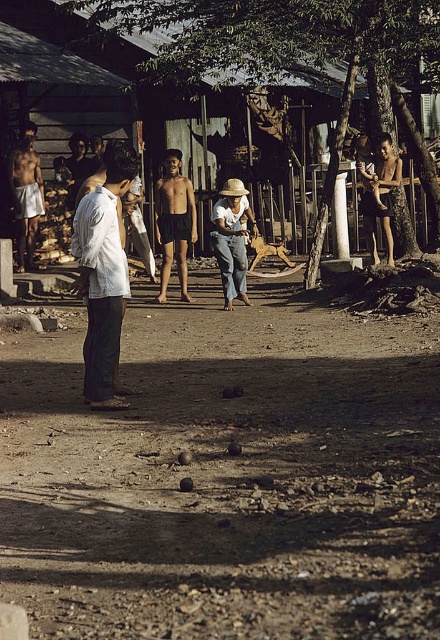
Question: Estimate the real-world distances between objects in this image. Which object is farther from the brown dirt field at center?

Choices:
 (A) light brown straw hat at center
 (B) dark blue shorts at center
 (C) matte white shorts at left
 (D) strawmaterial/texturehat at center

Answer: (C)

Question: Can you confirm if brown dirt field at center is positioned above white cotton shirt at left?

Choices:
 (A) yes
 (B) no

Answer: (B)

Question: Which of the following is the closest to the observer?

Choices:
 (A) brown dirt field at center
 (B) strawmaterial/texturehat at center
 (C) white cotton shirt at left

Answer: (A)

Question: Is dark blue shorts at center to the right of light brown straw hat at center from the viewer's perspective?

Choices:
 (A) yes
 (B) no

Answer: (B)

Question: Which of the following is the closest to the observer?

Choices:
 (A) (233, 184)
 (B) (286, 564)

Answer: (B)

Question: Does brown dirt field at center have a smaller size compared to white cotton shirt at left?

Choices:
 (A) no
 (B) yes

Answer: (B)